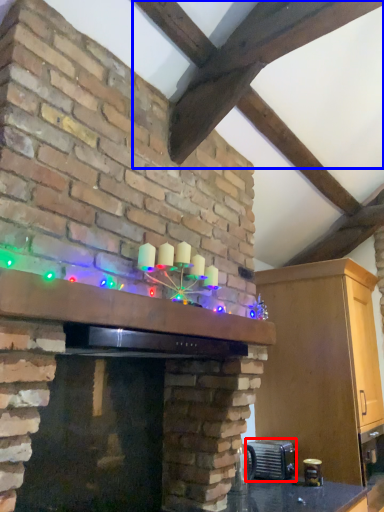
Question: Which object appears farthest to the camera in this image, appliance (highlighted by a red box) or exhaust hood (highlighted by a blue box)?

Choices:
 (A) appliance
 (B) exhaust hood

Answer: (A)